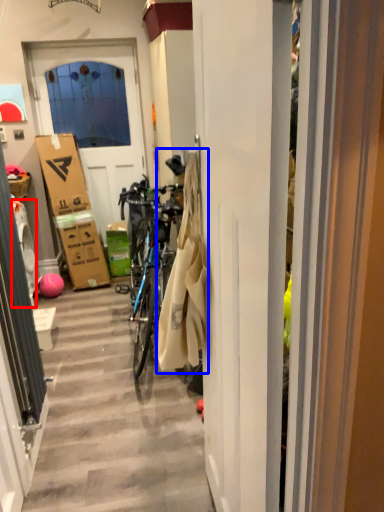
Question: Which object is closer to the camera taking this photo, washing machine (highlighted by a red box) or laundry (highlighted by a blue box)?

Choices:
 (A) washing machine
 (B) laundry

Answer: (B)